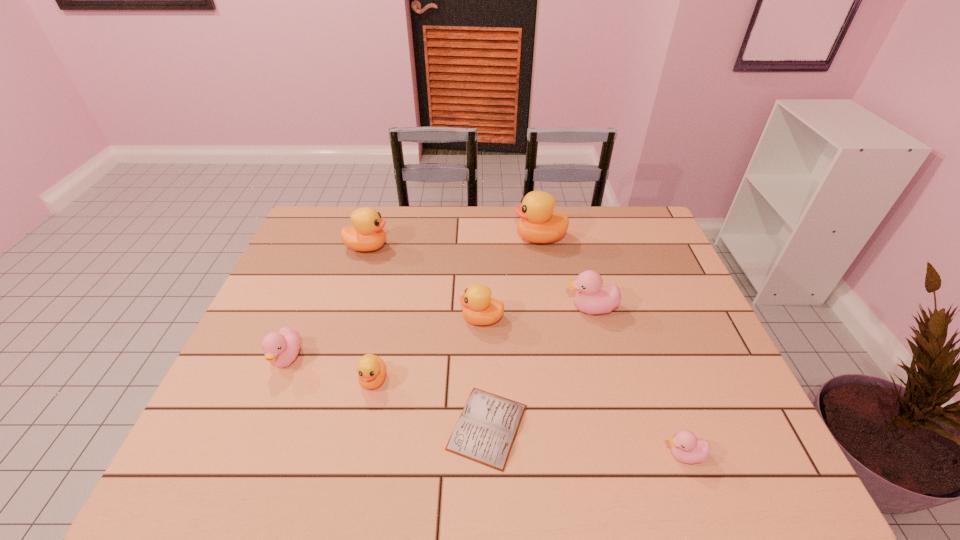
Identify the location of empty space between the farthest pink duckling and the fourth duckling from left to right. (537, 314).

Locate which object ranks third in proximity to the biggest pink duckling. Please provide its 2D coordinates. Your answer should be formatted as a tuple, i.e. [(x, y)], where the tuple contains the x and y coordinates of a point satisfying the conditions above.

[(486, 430)]

Locate an element on the screen. The height and width of the screenshot is (540, 960). object that is the nearest to the third yellow duckling from right to left is located at coordinates (486, 430).

Select which duckling is the sixth closest to the fourth duckling from left to right. Please provide its 2D coordinates. Your answer should be formatted as a tuple, i.e. [(x, y)], where the tuple contains the x and y coordinates of a point satisfying the conditions above.

[(685, 446)]

Select which duckling is the fifth closest to the second smallest yellow duckling. Please provide its 2D coordinates. Your answer should be formatted as a tuple, i.e. [(x, y)], where the tuple contains the x and y coordinates of a point satisfying the conditions above.

[(281, 348)]

Locate which yellow duckling ranks in proximity to the seventh object from right to left. Please provide its 2D coordinates. Your answer should be formatted as a tuple, i.e. [(x, y)], where the tuple contains the x and y coordinates of a point satisfying the conditions above.

[(479, 308)]

Point out which yellow duckling is positioned as the fourth nearest to the smallest pink duckling. Please provide its 2D coordinates. Your answer should be formatted as a tuple, i.e. [(x, y)], where the tuple contains the x and y coordinates of a point satisfying the conditions above.

[(366, 234)]

Identify which pink duckling is the nearest to the third object from left to right. Please provide its 2D coordinates. Your answer should be formatted as a tuple, i.e. [(x, y)], where the tuple contains the x and y coordinates of a point satisfying the conditions above.

[(281, 348)]

Locate an element on the screen. Image resolution: width=960 pixels, height=540 pixels. the closest pink duckling to the second biggest pink duckling is located at coordinates (592, 298).

Locate an element on the screen. The height and width of the screenshot is (540, 960). free space that satisfies the following two spatial constraints: 1. on the front-facing side of the farthest pink duckling; 2. on the front-facing side of the second biggest pink duckling is located at coordinates (604, 359).